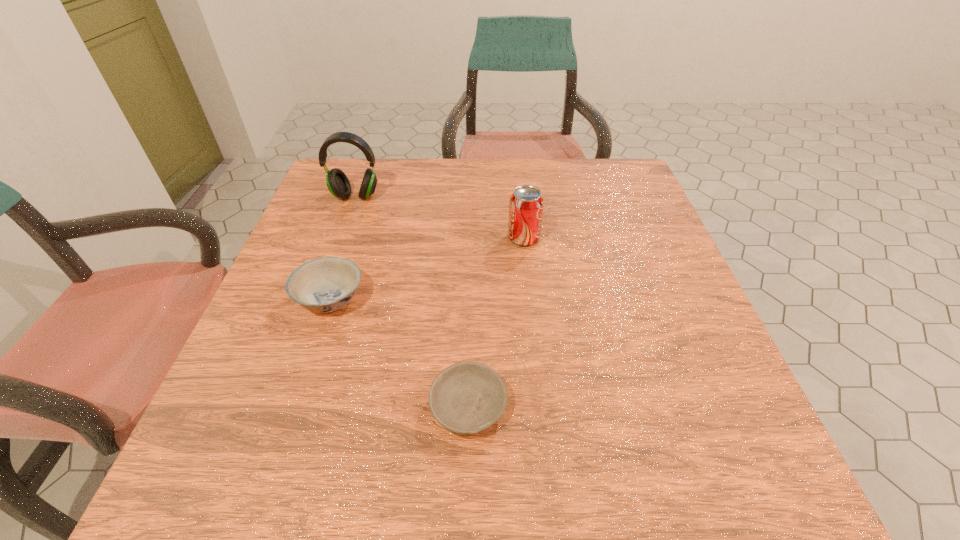
I want to click on the tallest object, so click(x=338, y=184).

You are a GUI agent. You are given a task and a screenshot of the screen. Output one action in this format:
    pyautogui.click(x=<x>, y=<y>)
    Task: Click on the farthest object
    The image size is (960, 540).
    Given the screenshot: What is the action you would take?
    pyautogui.click(x=338, y=184)

This screenshot has width=960, height=540. What are the coordinates of `the rightmost object` in the screenshot? It's located at (526, 204).

Find the location of a particular element. soda can is located at coordinates (526, 204).

This screenshot has width=960, height=540. Find the location of `the taller bowl`. the taller bowl is located at coordinates (322, 285).

Find the location of a particular element. The image size is (960, 540). the second nearest object is located at coordinates (322, 285).

The width and height of the screenshot is (960, 540). I want to click on the right bowl, so click(x=466, y=398).

At what (x,y) coordinates should I click in order to perform the action: click on the shorter bowl. Please return your answer as a coordinate pair (x, y). Looking at the image, I should click on 466,398.

This screenshot has width=960, height=540. What are the coordinates of `free region located 0.240m on the ear cups of the headset` in the screenshot? It's located at pyautogui.click(x=329, y=268).

In order to click on free space located 0.270m on the right of the second farthest object in this screenshot , I will do `click(654, 238)`.